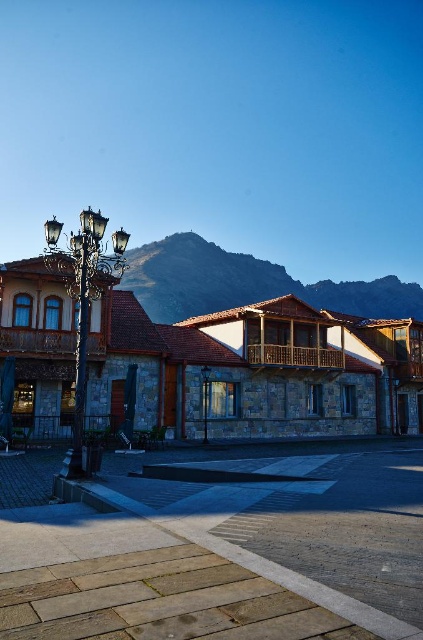
You are an architect designing a new building and want to ensure it fits well with the existing structures in the scene. Given the rugged stone mountain at upper center and the polished brass streetlamp at left, which object should you consider for scale when planning the building dimensions?

You should consider the rugged stone mountain at upper center because its width is larger than the polished brass streetlamp at left, indicating it occupies more space and would be a better reference for scale in the design.

You are standing in the square and want to find the metallic streetlamp at left. Based on the scene, where would you look relative to the buildings?

The metallic streetlamp at left is located at the lower left area of the scene, near the edge of the square closest to the buildings.